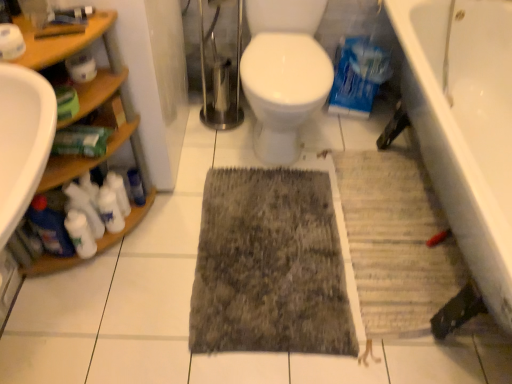
You are a GUI agent. You are given a task and a screenshot of the screen. Output one action in this format:
    pyautogui.click(x=<x>, y=<y>)
    Task: Click on the free area in between blue plastic bottle at left and gray textured bath mat at lower right
    The image size is (512, 384).
    Given the screenshot: What is the action you would take?
    pyautogui.click(x=271, y=225)